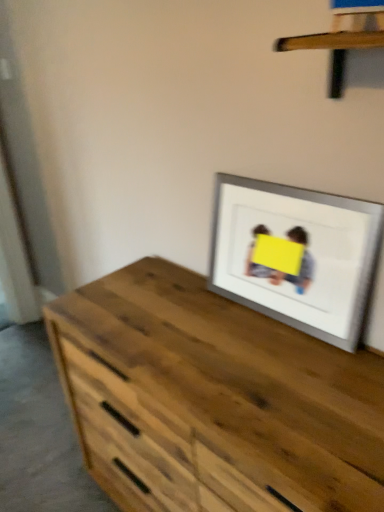
You are a GUI agent. You are given a task and a screenshot of the screen. Output one action in this format:
    pyautogui.click(x=<x>, y=<y>)
    Task: Click on the vacant area on top of wooden chest of drawers at center (from a real-world perspective)
    This screenshot has width=384, height=512.
    Given the screenshot: What is the action you would take?
    pyautogui.click(x=224, y=334)